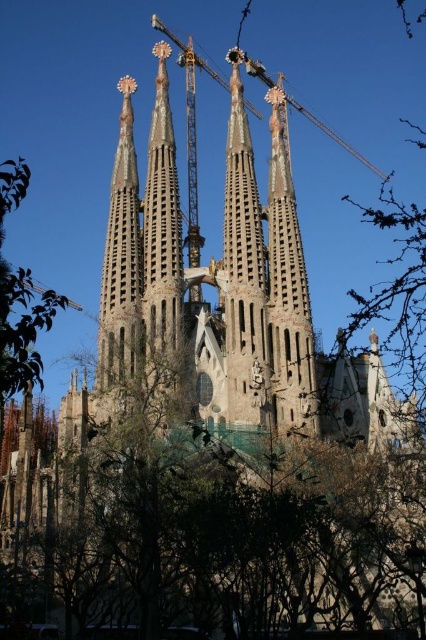
Question: Which point is closer to the camera?

Choices:
 (A) (233, 205)
 (B) (0, 392)

Answer: (B)

Question: Is rustic stone tower at center thinner than metallic gray crane at upper center?

Choices:
 (A) yes
 (B) no

Answer: (A)

Question: Based on their relative distances, which object is nearer to the green leafy tree at lower center?

Choices:
 (A) rustic stone tower at center
 (B) green leafy tree at left
 (C) metallic gray crane at upper center

Answer: (A)

Question: Which point is closer to the camera taking this photo?

Choices:
 (A) (253, 339)
 (B) (2, 388)
 (C) (154, 19)

Answer: (B)

Question: Is rustic stone tower at center above metallic gray crane at upper center?

Choices:
 (A) no
 (B) yes

Answer: (A)

Question: Does green leafy tree at lower center have a smaller size compared to rustic stone tower at center?

Choices:
 (A) no
 (B) yes

Answer: (A)